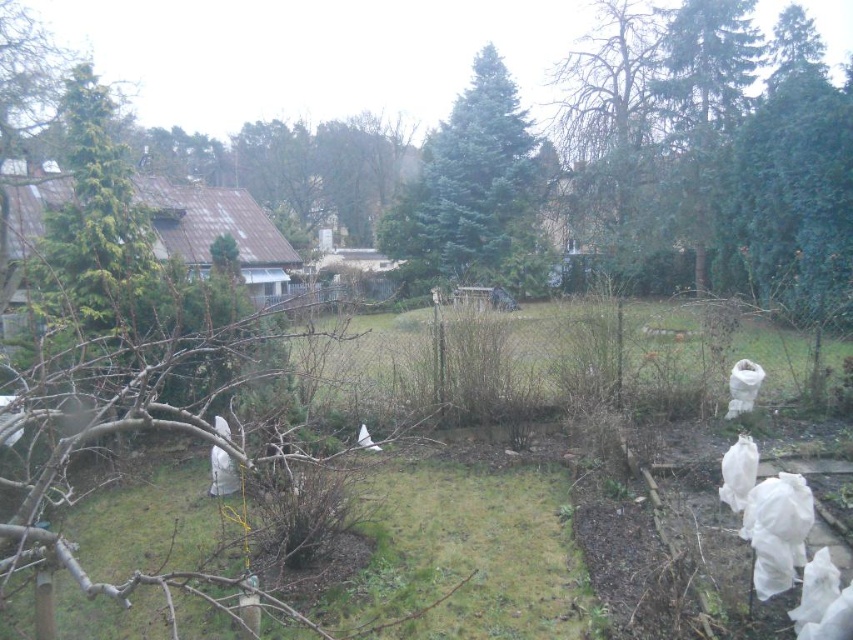
Can you confirm if green matte evergreen tree at center is positioned to the left of green needle-like tree at upper right?

Correct, you'll find green matte evergreen tree at center to the left of green needle-like tree at upper right.

Is green matte evergreen tree at center smaller than green needle-like tree at upper right?

No.

This screenshot has height=640, width=853. I want to click on green matte evergreen tree at center, so click(474, 192).

I want to click on green matte evergreen tree at center, so point(474,192).

Can you confirm if green textured tree at upper center is taller than green needle-like tree at upper left?

Yes, green textured tree at upper center is taller than green needle-like tree at upper left.

Describe the element at coordinates (611, 124) in the screenshot. I see `green textured tree at upper center` at that location.

Locate an element on the screen. green textured tree at upper center is located at coordinates (611, 124).

Between green needle-like tree at upper left and green needle-like tree at upper right, which one appears on the left side from the viewer's perspective?

green needle-like tree at upper left is more to the left.

Which is more to the right, green needle-like tree at upper left or green needle-like tree at upper right?

Positioned to the right is green needle-like tree at upper right.

Identify the location of green needle-like tree at upper left. (96, 228).